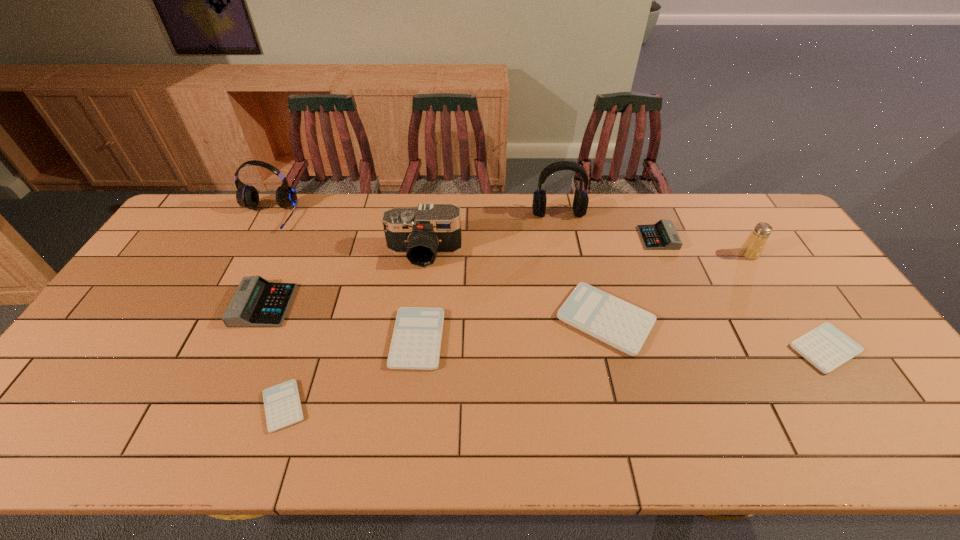
This screenshot has width=960, height=540. What are the coordinates of `calculator positioned at the right edge` in the screenshot? It's located at (826, 347).

Find the location of a particular element. free location at the far edge of the desktop is located at coordinates (707, 208).

You are a GUI agent. You are given a task and a screenshot of the screen. Output one action in this format:
    pyautogui.click(x=<x>, y=<y>)
    Task: Click on the free location at the near edge of the desktop
    This screenshot has height=540, width=960.
    Given the screenshot: What is the action you would take?
    pyautogui.click(x=260, y=417)

Image resolution: width=960 pixels, height=540 pixels. What are the coordinates of `blank space at the left edge of the desktop` in the screenshot? It's located at (114, 362).

The image size is (960, 540). Identify the location of free space at the right edge of the desktop. (767, 247).

Locate an element on the screen. The image size is (960, 540). free space at the far left corner of the desktop is located at coordinates (204, 219).

Locate an element on the screen. This screenshot has height=540, width=960. unoccupied area between the left headset and the third calculator from left to right is located at coordinates (343, 278).

At what (x,y) coordinates should I click in order to perform the action: click on blank region between the fourth shortest calculator and the third tallest object. Please return your answer as a coordinate pair (x, y). Image resolution: width=960 pixels, height=540 pixels. Looking at the image, I should click on (515, 286).

This screenshot has height=540, width=960. Find the location of `unoccupied position between the camera and the third calculator from right to left`. unoccupied position between the camera and the third calculator from right to left is located at coordinates (515, 286).

Where is `vacant space that is in between the third white calculator from right to left and the right gray calculator`? This screenshot has height=540, width=960. vacant space that is in between the third white calculator from right to left and the right gray calculator is located at coordinates (538, 288).